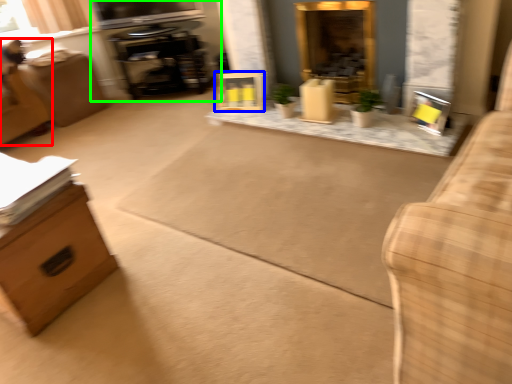
Question: Considering the real-world distances, which object is closest to swivel chair (highlighted by a red box)? picture frame (highlighted by a blue box) or entertainment center (highlighted by a green box).

Choices:
 (A) picture frame
 (B) entertainment center

Answer: (B)